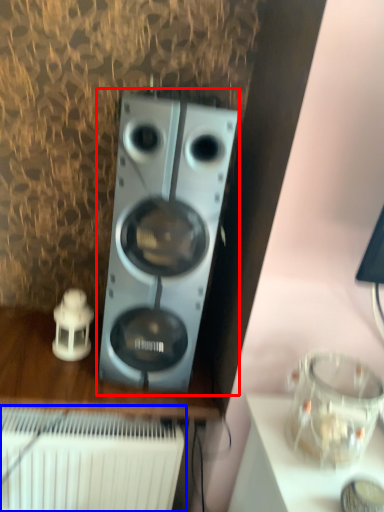
Question: Among these objects, which one is farthest to the camera, home appliance (highlighted by a red box) or radiator (highlighted by a blue box)?

Choices:
 (A) home appliance
 (B) radiator

Answer: (B)